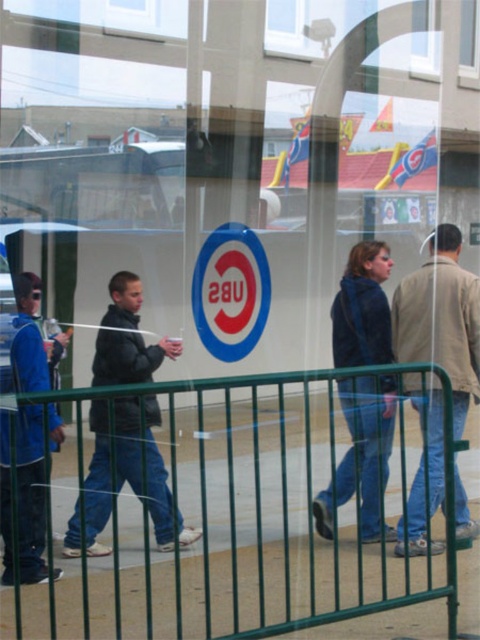
Is green metal fence at lower center thinner than matte blue jacket at left?

No.

Does green metal fence at lower center have a lesser height compared to matte blue jacket at left?

Correct, green metal fence at lower center is not as tall as matte blue jacket at left.

Who is more distant from viewer, (307, 515) or (46, 564)?

Point (307, 515)

I want to click on green metal fence at lower center, so click(x=233, y=529).

Does point (266, 508) lie behind point (379, 330)?

Yes, point (266, 508) is behind point (379, 330).

Between point (375, 404) and point (357, 285), which one is positioned behind?

Point (357, 285)

Who is more forward, (136,627) or (345,310)?

Point (136,627) is more forward.

This screenshot has height=640, width=480. I want to click on green metal fence at lower center, so coord(233,529).

Does point (283, 563) come in front of point (458, 323)?

No, (283, 563) is further to viewer.

Consider the image. Who is more forward, (x=70, y=566) or (x=441, y=304)?

Point (x=441, y=304) is more forward.

Between point (263, 544) and point (404, 316), which one is positioned in front?

Point (404, 316) is in front.

Find the location of `green metal fence at lower center`. green metal fence at lower center is located at coordinates (233, 529).